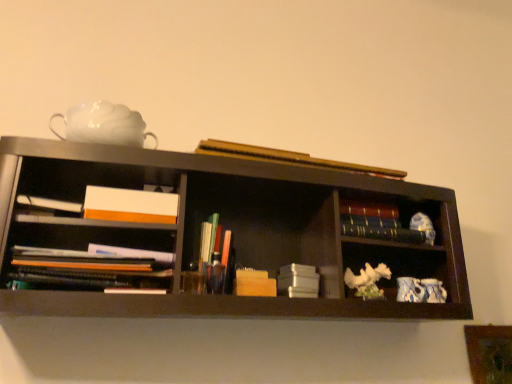
Question: In the image, is dark blue hardcover book at center right, placed as the 6th book when sorted from left to right, on the left side or the right side of hardcover book at upper center, which is counted as the 5th book, starting from the left?

Choices:
 (A) left
 (B) right

Answer: (B)

Question: Looking at their shapes, would you say dark blue hardcover book at center right, placed as the 6th book when sorted from left to right, is wider or thinner than hardcover book at upper center, which is counted as the 5th book, starting from the left?

Choices:
 (A) wide
 (B) thin

Answer: (B)

Question: Which object is positioned farthest from the white matte teapot at upper left?

Choices:
 (A) blue and white porcelain teapot at lower right
 (B) wooden block at center, the third book positioned from the left
 (C) matte plastic pens at center, arranged as the 2th book when viewed from the left
 (D) wooden picture frame at lower right
 (E) hardcover book at upper center, which is counted as the 5th book, starting from the left

Answer: (D)

Question: Which object is the farthest from the matte black books at left, the 1th book positioned from the left?

Choices:
 (A) matte plastic pens at center, the fifth book positioned from the right
 (B) wooden picture frame at lower right
 (C) blue and white porcelain teapot at lower right
 (D) white matte stack of books at center, placed as the third book when sorted from right to left
 (E) white matte teapot at upper left

Answer: (B)